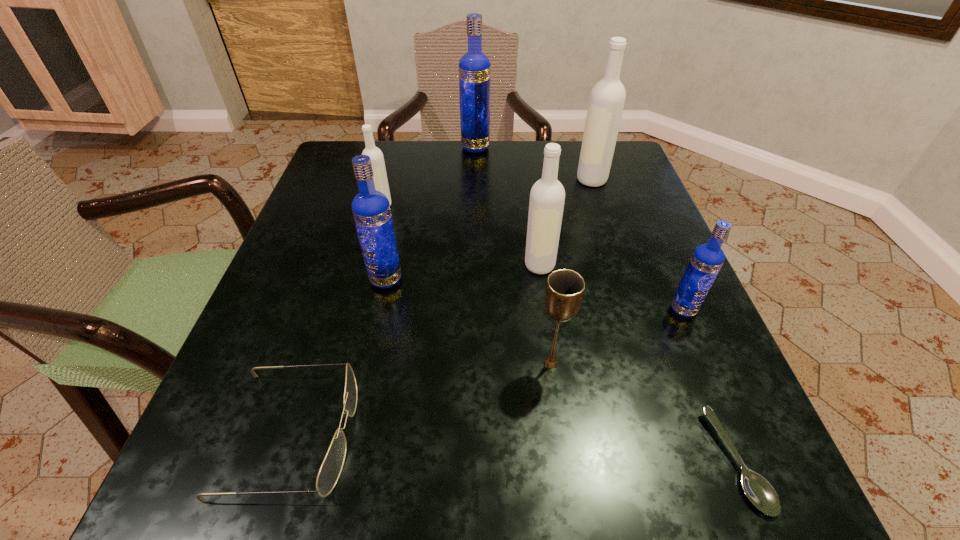
I want to click on the third vodka from left to right, so click(x=474, y=67).

Identify the location of the second blue vodka from left to right. (474, 67).

Locate an element on the screen. The image size is (960, 540). the biggest white vodka is located at coordinates [x=607, y=98].

Find the location of a particular element. the fifth vodka from left to right is located at coordinates (607, 98).

Where is `the second white vodka from left to right`? This screenshot has height=540, width=960. the second white vodka from left to right is located at coordinates (547, 196).

This screenshot has width=960, height=540. What are the coordinates of `the fourth vodka from left to right` in the screenshot? It's located at (547, 196).

Locate an element on the screen. Image resolution: width=960 pixels, height=540 pixels. the leftmost blue vodka is located at coordinates (371, 210).

I want to click on the second smallest blue vodka, so click(x=371, y=210).

At what (x,y) coordinates should I click in order to perform the action: click on the rightmost blue vodka. Please return your answer as a coordinate pair (x, y). The image size is (960, 540). Looking at the image, I should click on (707, 259).

The image size is (960, 540). In order to click on the nearest blue vodka in this screenshot , I will do `click(707, 259)`.